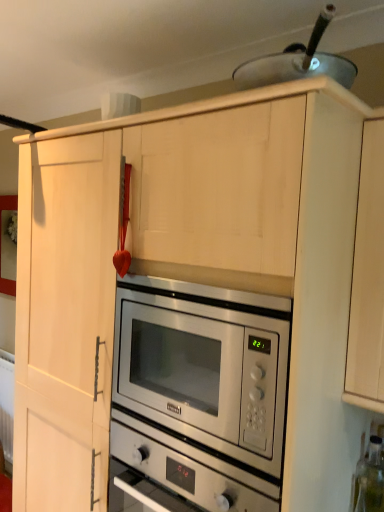
Describe the element at coordinates (205, 365) in the screenshot. The image size is (384, 512). I see `stainless steel microwave at center` at that location.

At what (x,y) coordinates should I click in order to perform the action: click on stainless steel microwave at center. Please return your answer as a coordinate pair (x, y). Looking at the image, I should click on (205, 365).

What is the approximate width of stainless steel microwave at center?

stainless steel microwave at center is 61.96 centimeters wide.

In order to face stainless steel microwave at center, should I rotate leftwards or rightwards?

You should look right and rotate roughly 6.218 degrees.

I want to click on stainless steel microwave at center, so click(205, 365).